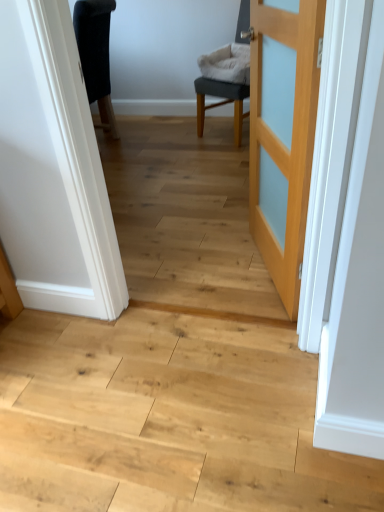
Where is `blank space situated above natural wood floor at center (from a real-world perspective)`? blank space situated above natural wood floor at center (from a real-world perspective) is located at coordinates (143, 412).